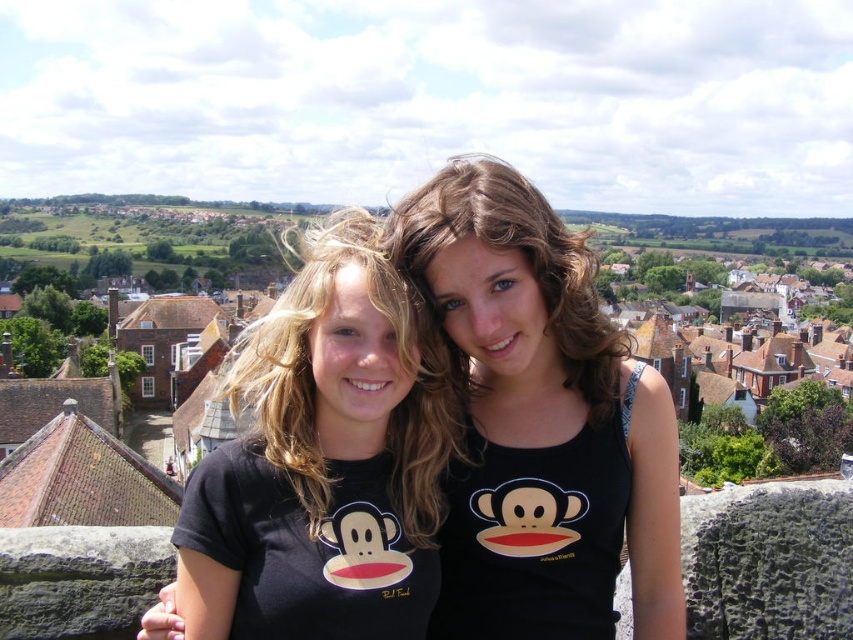
You are a photographer trying to capture the black matte tank top at center in the image. What are the coordinates where you should focus your camera to ensure it is centered in the frame?

The coordinates to focus on are (x=538, y=422) to center the black matte tank top at center.

You are a photographer trying to capture a group photo of two people standing on a rooftop. The two people are currently at the coordinates point (395, 333). If you want them to be 2 meters apart in the photo, should they move closer or farther away from each other?

The two people at point (395, 333) are currently 36.64 meters apart. To be 2 meters apart in the photo, they need to move much closer to each other.